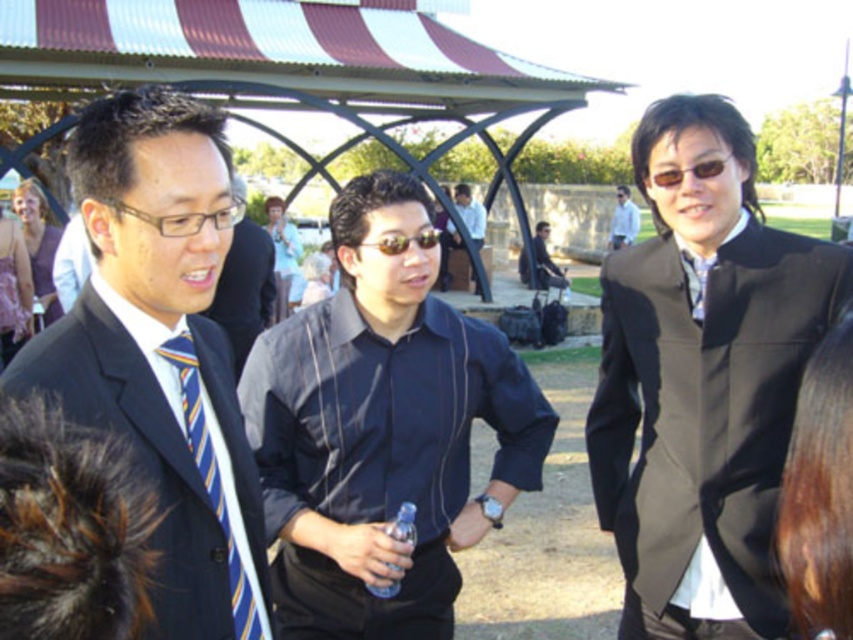
Is black satin suit at center thinner than matte black shirt at center?

In fact, black satin suit at center might be wider than matte black shirt at center.

Does point (759, 529) come behind point (561, 273)?

That is False.

You are a GUI agent. You are given a task and a screenshot of the screen. Output one action in this format:
    pyautogui.click(x=<x>, y=<y>)
    Task: Click on the black satin suit at center
    The image size is (853, 640).
    Given the screenshot: What is the action you would take?
    pyautogui.click(x=703, y=380)

Between point (91, 365) and point (210, 452), which one is positioned behind?

Point (210, 452)

Is matte black suit at left further to the viewer compared to striped silk tie at left?

No, it is not.

Does point (190, 310) lie behind point (192, 381)?

No, it is not.

The width and height of the screenshot is (853, 640). What are the coordinates of `matte black suit at left` in the screenshot? It's located at (163, 349).

Looking at this image, between striped silk tie at left and matte black suit at center, which one has less height?

With less height is striped silk tie at left.

Which is more to the left, striped silk tie at left or matte black suit at center?

matte black suit at center is more to the left.

The image size is (853, 640). Describe the element at coordinates (213, 484) in the screenshot. I see `striped silk tie at left` at that location.

Identify the location of striped silk tie at left. (213, 484).